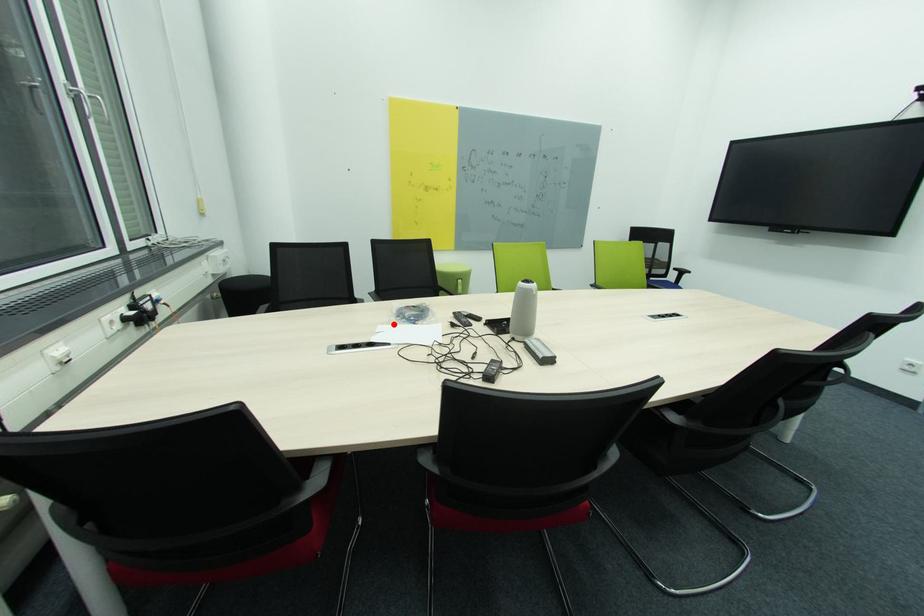
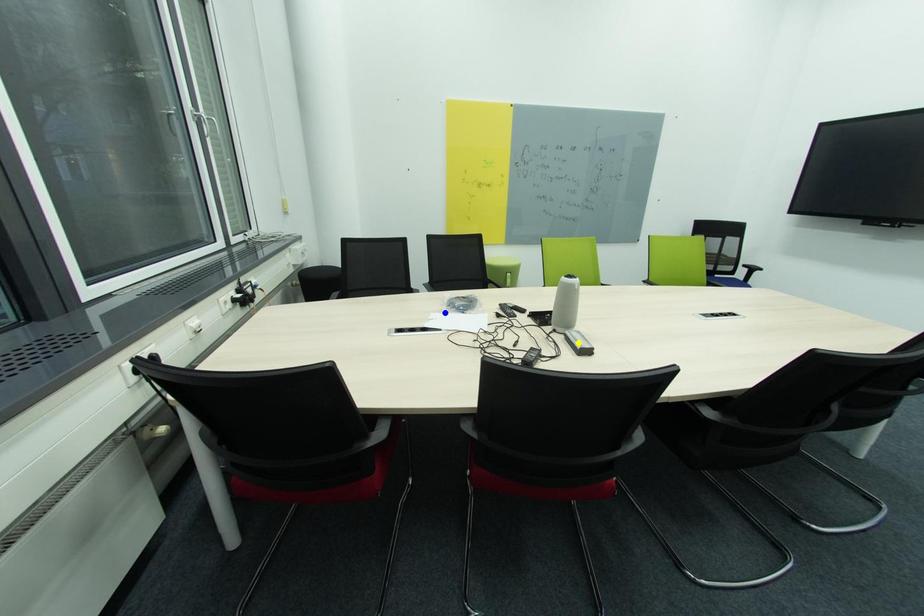
Question: I am providing you with two images of the same scene from different viewpoints. A red point is marked on the first image. You are given multiple points on the second image. In image 2, which mark is for the same physical point as the one in image 1?

Choices:
 (A) blue point
 (B) green point
 (C) yellow point

Answer: (A)